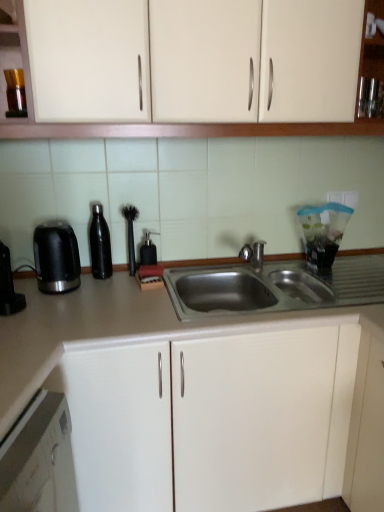
This screenshot has height=512, width=384. Identify the location of free space behind black plastic coffee machine at left. (26, 290).